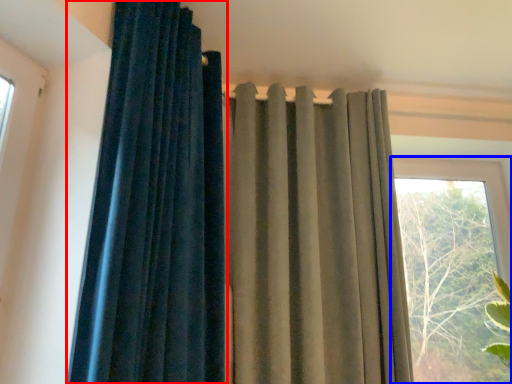
Question: Among these objects, which one is farthest to the camera, curtain (highlighted by a red box) or window (highlighted by a blue box)?

Choices:
 (A) curtain
 (B) window

Answer: (B)